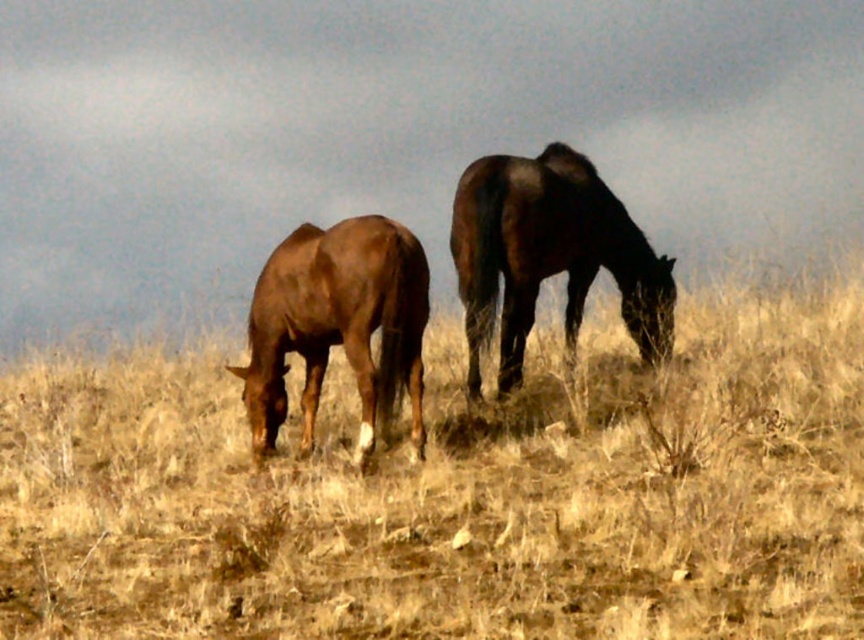
Looking at this image, is shiny dark brown horse at center to the left of brown glossy horse at left from the viewer's perspective?

In fact, shiny dark brown horse at center is to the right of brown glossy horse at left.

Consider the image. Who is shorter, shiny dark brown horse at center or brown glossy horse at left?

With less height is brown glossy horse at left.

Which is behind, point (480, 180) or point (337, 288)?

The point (480, 180) is behind.

At what (x,y) coordinates should I click in order to perform the action: click on shiny dark brown horse at center. Please return your answer as a coordinate pair (x, y). Image resolution: width=864 pixels, height=640 pixels. Looking at the image, I should click on (550, 253).

Does brown grassy at center have a greater height compared to shiny dark brown horse at center?

No.

Which is more to the left, brown grassy at center or shiny dark brown horse at center?

From the viewer's perspective, shiny dark brown horse at center appears more on the left side.

Image resolution: width=864 pixels, height=640 pixels. Describe the element at coordinates (456, 492) in the screenshot. I see `brown grassy at center` at that location.

What are the coordinates of `brown grassy at center` in the screenshot? It's located at (456, 492).

Does brown grassy at center appear under brown glossy horse at left?

Yes, brown grassy at center is below brown glossy horse at left.

At what (x,y) coordinates should I click in order to perform the action: click on brown grassy at center. Please return your answer as a coordinate pair (x, y). Looking at the image, I should click on (456, 492).

Which is in front, point (168, 429) or point (361, 372)?

Positioned in front is point (361, 372).

Find the location of a particular element. The height and width of the screenshot is (640, 864). brown grassy at center is located at coordinates (456, 492).